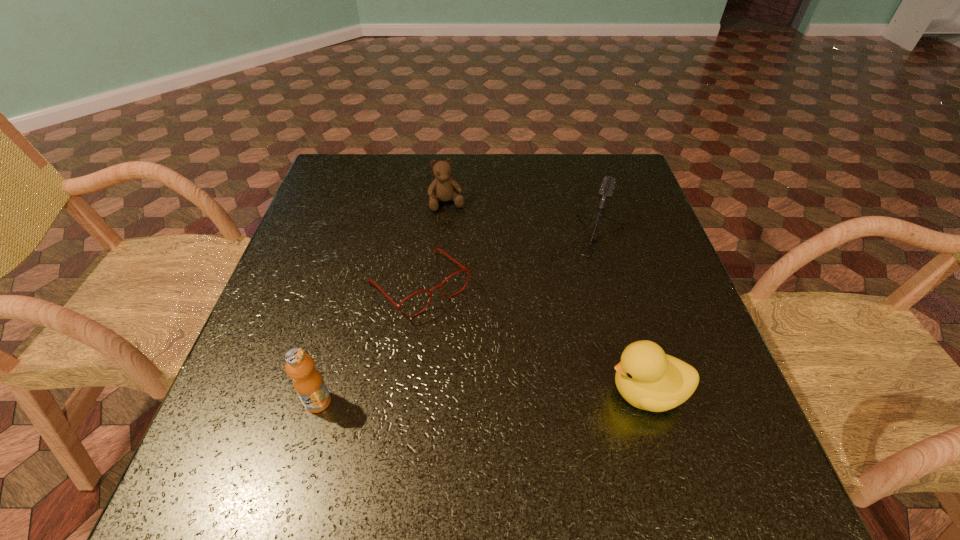
Find the location of a particular element. The image size is (960, 540). unoccupied position between the microphone and the teddy bear is located at coordinates (518, 223).

Find the location of `object that ranks as the third closest to the shortest object`. object that ranks as the third closest to the shortest object is located at coordinates (606, 190).

The width and height of the screenshot is (960, 540). What are the coordinates of `object that is the third closest to the duck` in the screenshot? It's located at [308, 383].

Identify the location of vacant region that satisfies the following two spatial constraints: 1. on the front side of the shortest object; 2. on the front-facing side of the duck. The image size is (960, 540). (405, 392).

Where is `vacant position in the image that satisfies the following two spatial constraints: 1. on the front side of the microphone; 2. on the front-facing side of the duck`? vacant position in the image that satisfies the following two spatial constraints: 1. on the front side of the microphone; 2. on the front-facing side of the duck is located at coordinates (628, 392).